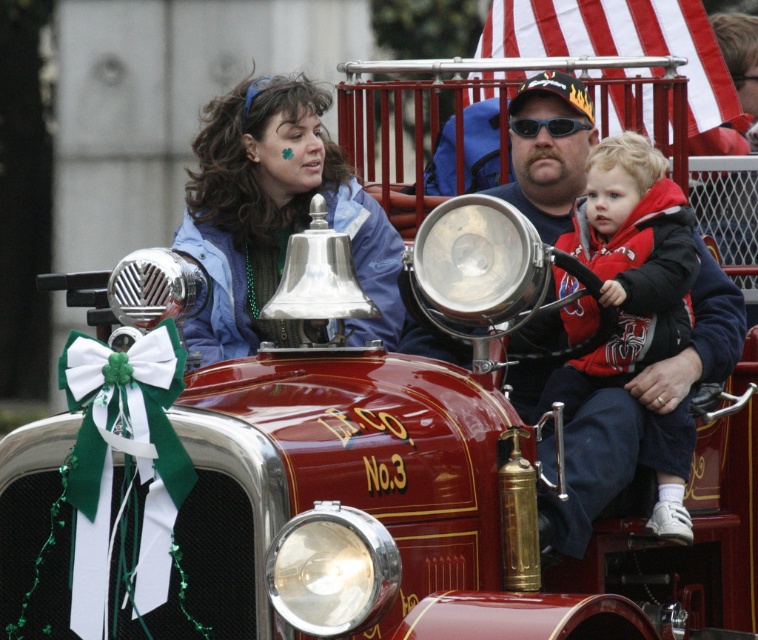
Does blue fleece jacket at center appear on the left side of red fleece jacket at center?

Yes, blue fleece jacket at center is to the left of red fleece jacket at center.

You are a GUI agent. You are given a task and a screenshot of the screen. Output one action in this format:
    pyautogui.click(x=<x>, y=<y>)
    Task: Click on the blue fleece jacket at center
    The width and height of the screenshot is (758, 640).
    Given the screenshot: What is the action you would take?
    pyautogui.click(x=274, y=212)

Image resolution: width=758 pixels, height=640 pixels. Find the location of `blue fleece jacket at center`. blue fleece jacket at center is located at coordinates pos(274,212).